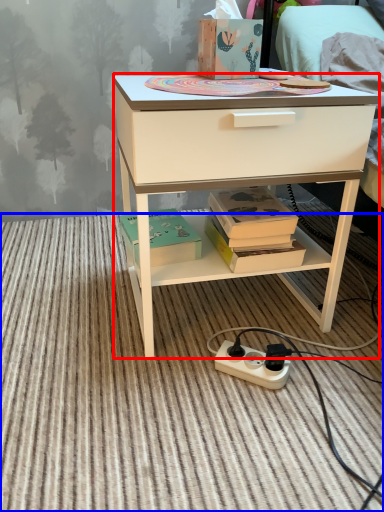
Question: Among these objects, which one is nearest to the camera, desk (highlighted by a red box) or plain (highlighted by a blue box)?

Choices:
 (A) desk
 (B) plain

Answer: (B)